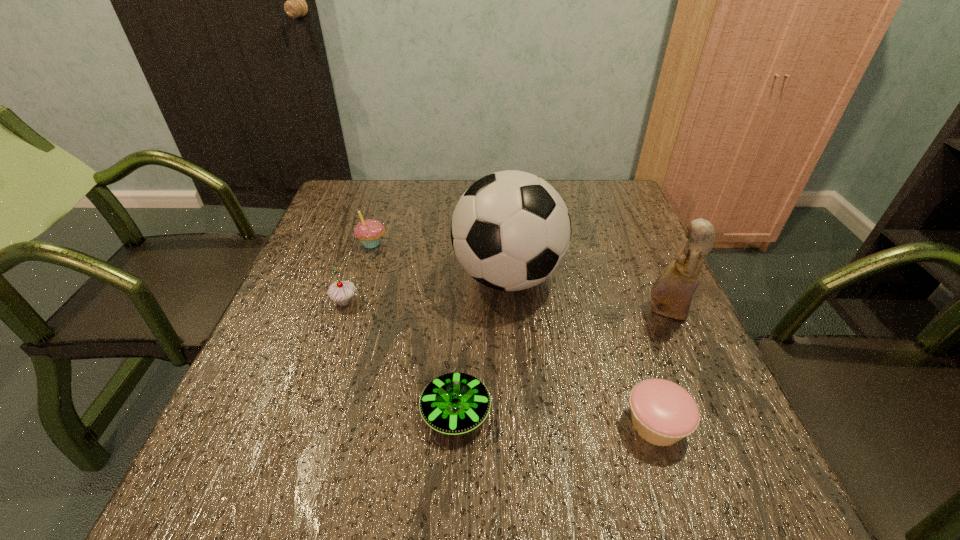
You are a GUI agent. You are given a task and a screenshot of the screen. Output one action in this format:
    pyautogui.click(x=<x>, y=<y>)
    Task: Click on the blank region between the nearest cupcake and the figurine
    The image size is (960, 540).
    Given the screenshot: What is the action you would take?
    pyautogui.click(x=660, y=368)

Image resolution: width=960 pixels, height=540 pixels. Identify the location of empty space that is in between the second nearest cupcake and the saucer. (400, 357).

Identify the location of vacant area that lies between the soccer ball and the second tallest cupcake. This screenshot has width=960, height=540. (426, 289).

Image resolution: width=960 pixels, height=540 pixels. I want to click on empty location between the figurine and the second shortest cupcake, so click(505, 307).

The image size is (960, 540). I want to click on object that is the fourth closest to the saucer, so click(672, 292).

Where is `object identified as the third closest to the farthest cupcake`? Image resolution: width=960 pixels, height=540 pixels. object identified as the third closest to the farthest cupcake is located at coordinates (454, 403).

Identify which cupcake is the closest to the second object from right to left. Please provide its 2D coordinates. Your answer should be formatted as a tuple, i.e. [(x, y)], where the tuple contains the x and y coordinates of a point satisfying the conditions above.

[(341, 292)]

Identify which cupcake is the closest to the farthest cupcake. Please provide its 2D coordinates. Your answer should be formatted as a tuple, i.e. [(x, y)], where the tuple contains the x and y coordinates of a point satisfying the conditions above.

[(341, 292)]

Locate an element on the screen. This screenshot has height=540, width=960. vacant space that satisfies the following two spatial constraints: 1. on the back side of the third shortest object; 2. on the right side of the farthest cupcake is located at coordinates (364, 244).

Image resolution: width=960 pixels, height=540 pixels. Identify the location of vacant space that satisfies the following two spatial constraints: 1. on the front-facing side of the rightmost object; 2. on the front side of the nearest cupcake. (715, 424).